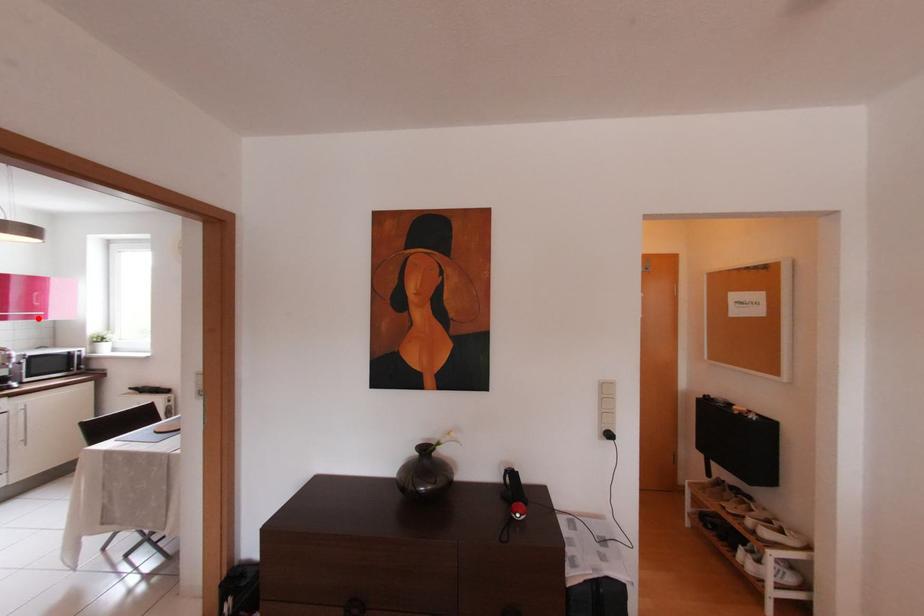
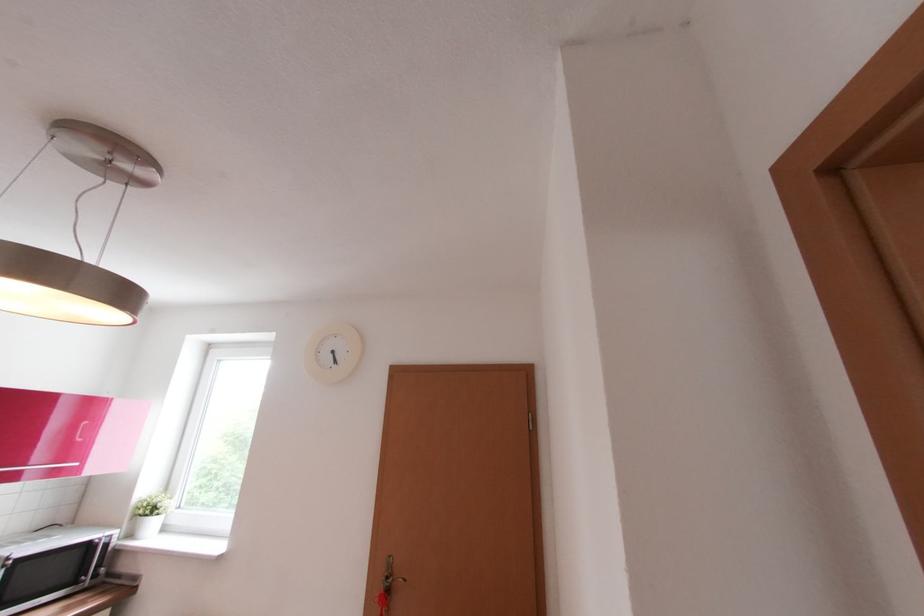
Locate, in the second image, the point that corresponds to the highlighted location in the first image.

(62, 472)